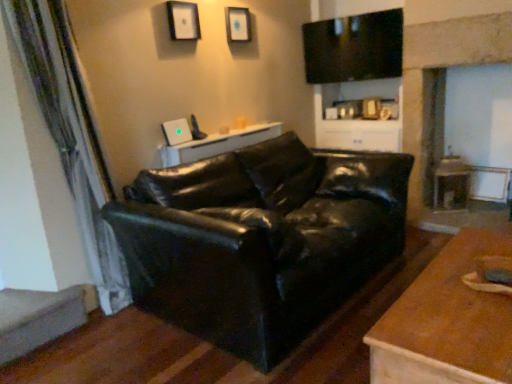
Question: From the image's perspective, is matte white picture frame at upper center, the second picture frame viewed from the front, on matte black entertainment center at upper center?

Choices:
 (A) no
 (B) yes

Answer: (B)

Question: Is matte white picture frame at upper center, the first picture frame when ordered from right to left, behind matte black entertainment center at upper center?

Choices:
 (A) yes
 (B) no

Answer: (B)

Question: Does matte white picture frame at upper center, the first picture frame when ordered from right to left, have a greater width compared to matte black entertainment center at upper center?

Choices:
 (A) yes
 (B) no

Answer: (B)

Question: Is matte white picture frame at upper center, marked as the second picture frame in a left-to-right arrangement, smaller than matte black entertainment center at upper center?

Choices:
 (A) yes
 (B) no

Answer: (A)

Question: From a real-world perspective, is matte white picture frame at upper center, the second picture frame viewed from the front, over matte black entertainment center at upper center?

Choices:
 (A) yes
 (B) no

Answer: (A)

Question: Considering the positions of matte black entertainment center at upper center and wooden side table at right in the image, is matte black entertainment center at upper center bigger or smaller than wooden side table at right?

Choices:
 (A) small
 (B) big

Answer: (B)

Question: Considering the positions of point (375, 119) and point (450, 203), is point (375, 119) closer or farther from the camera than point (450, 203)?

Choices:
 (A) farther
 (B) closer

Answer: (A)

Question: From the image's perspective, is matte black entertainment center at upper center located above or below wooden side table at right?

Choices:
 (A) above
 (B) below

Answer: (A)

Question: Visually, is matte black entertainment center at upper center positioned to the left or to the right of wooden side table at right?

Choices:
 (A) left
 (B) right

Answer: (A)

Question: From a real-world perspective, is green textured curtain at left positioned above or below wooden coffee table at lower right, the first table when ordered from bottom to top?

Choices:
 (A) below
 (B) above

Answer: (B)

Question: In terms of width, does green textured curtain at left look wider or thinner when compared to wooden coffee table at lower right, which is the first table from front to back?

Choices:
 (A) thin
 (B) wide

Answer: (A)

Question: Choose the correct answer: Is green textured curtain at left inside wooden coffee table at lower right, placed as the second table when sorted from left to right, or outside it?

Choices:
 (A) outside
 (B) inside

Answer: (A)

Question: Based on their positions, is green textured curtain at left located to the left or right of wooden coffee table at lower right, which appears as the first table when viewed from the right?

Choices:
 (A) left
 (B) right

Answer: (A)

Question: From a real-world perspective, is wooden coffee table at lower right, which is the first table from front to back, positioned above or below white glossy table at center, arranged as the second table when viewed from the right?

Choices:
 (A) below
 (B) above

Answer: (A)

Question: In terms of width, does wooden coffee table at lower right, placed as the second table when sorted from back to front, look wider or thinner when compared to white glossy table at center, placed as the second table when sorted from bottom to top?

Choices:
 (A) wide
 (B) thin

Answer: (A)